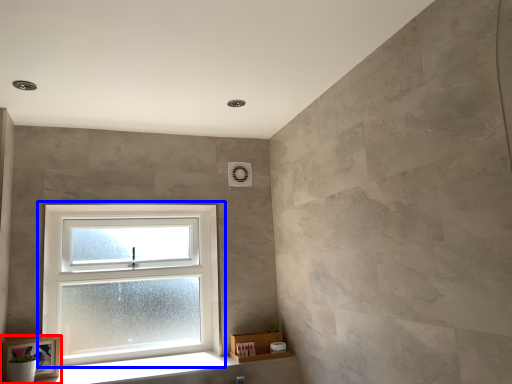
Question: Among these objects, which one is nearest to the camera, picture frame (highlighted by a red box) or window (highlighted by a blue box)?

Choices:
 (A) picture frame
 (B) window

Answer: (A)